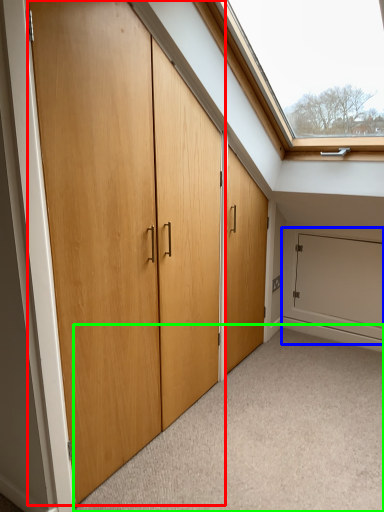
Question: Estimate the real-world distances between objects in this image. Which object is farther from door (highlighted by a red box), garage door (highlighted by a blue box) or plain (highlighted by a green box)?

Choices:
 (A) garage door
 (B) plain

Answer: (A)